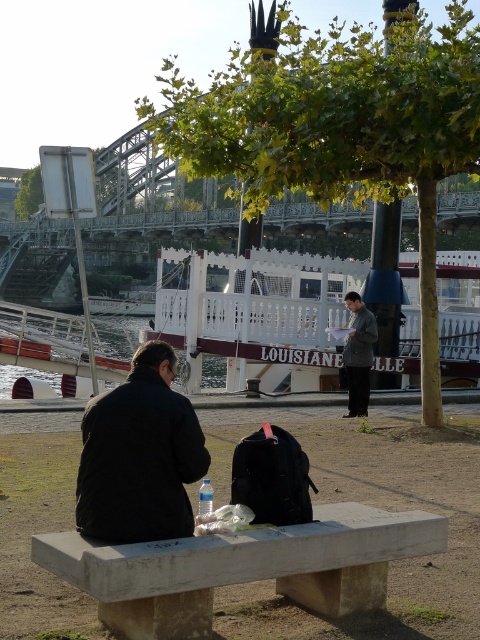
Is gray concrete bench at lower center taller than black matte jacket at lower left?

In fact, gray concrete bench at lower center may be shorter than black matte jacket at lower left.

What do you see at coordinates (241, 566) in the screenshot? The width and height of the screenshot is (480, 640). I see `gray concrete bench at lower center` at bounding box center [241, 566].

Identify the location of gray concrete bench at lower center. This screenshot has width=480, height=640. (241, 566).

Is black matte jacket at lower left below dark gray jacket at center?

Yes, black matte jacket at lower left is below dark gray jacket at center.

Can you confirm if black matte jacket at lower left is positioned above dark gray jacket at center?

Actually, black matte jacket at lower left is below dark gray jacket at center.

I want to click on black matte jacket at lower left, so pos(140,456).

Is gray concrete bench at lower center to the left of dark gray jacket at center from the viewer's perspective?

Correct, you'll find gray concrete bench at lower center to the left of dark gray jacket at center.

Measure the distance between gray concrete bench at lower center and camera.

They are 3.64 meters apart.

At what (x,y) coordinates should I click in order to perform the action: click on gray concrete bench at lower center. Please return your answer as a coordinate pair (x, y). Looking at the image, I should click on (241, 566).